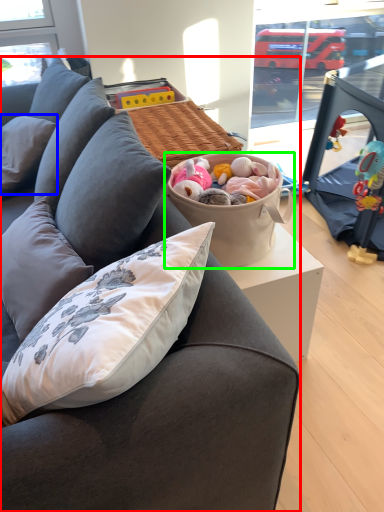
Question: Estimate the real-world distances between objects in this image. Which object is farther from studio couch (highlighted by a red box), pillow (highlighted by a blue box) or picnic basket (highlighted by a green box)?

Choices:
 (A) pillow
 (B) picnic basket

Answer: (A)